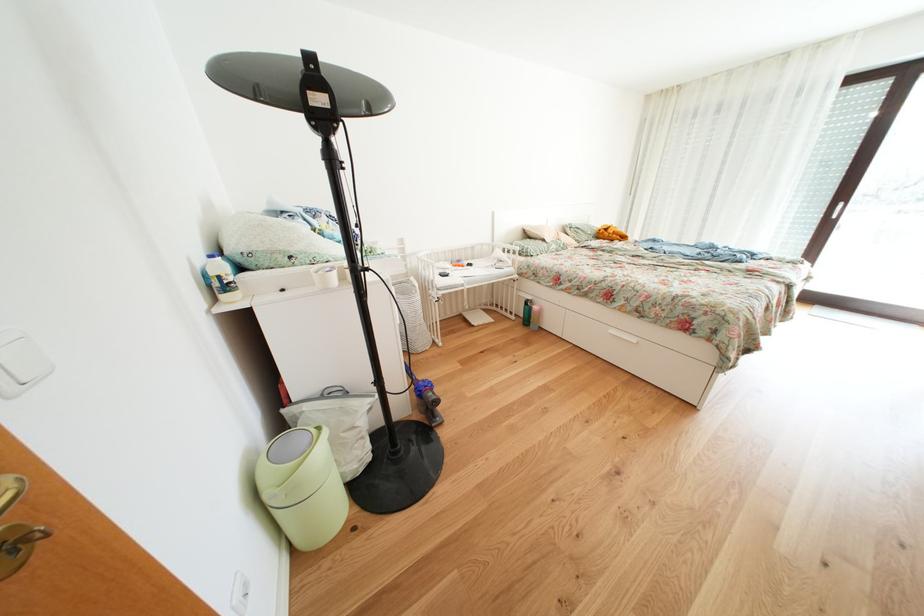
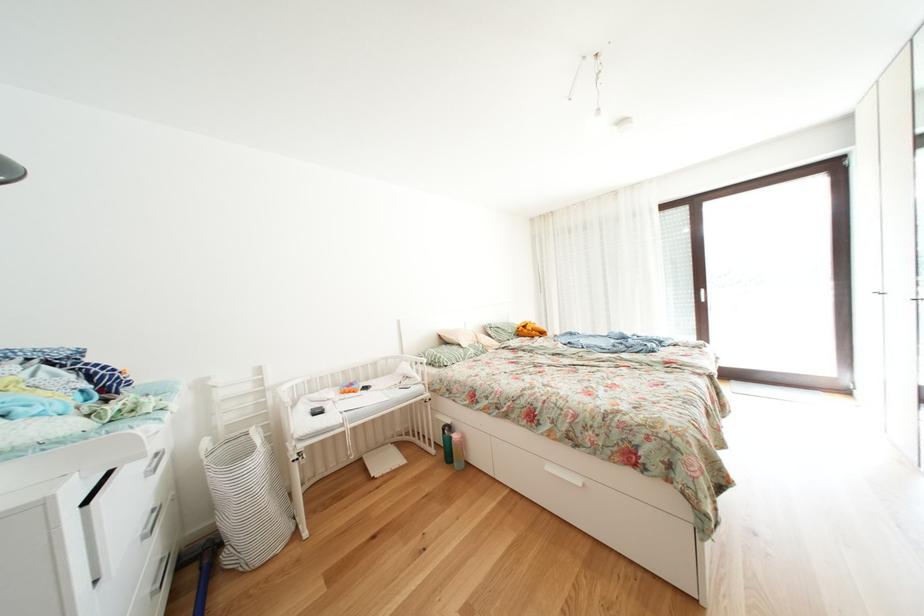
Locate, in the second image, the point that corresponds to pixel 541 307 in the first image.

(458, 432)